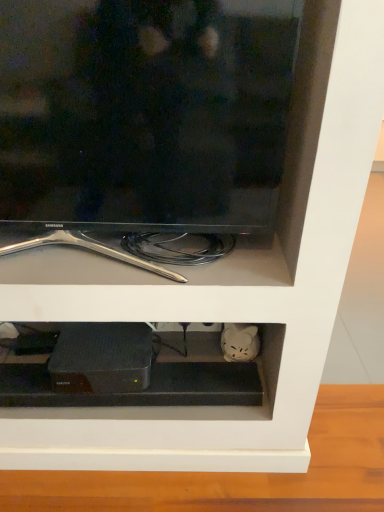
Find the location of `free spot below black glossy tv at upper center (from a real-world perspective)`. free spot below black glossy tv at upper center (from a real-world perspective) is located at coordinates (134, 267).